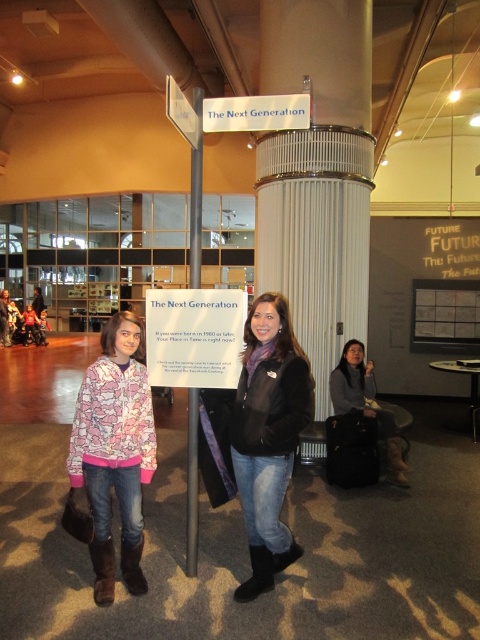
Question: Is black leather jacket at center smaller than dark gray sweater at center?

Choices:
 (A) yes
 (B) no

Answer: (A)

Question: Is the position of black leather jacket at center more distant than that of dark gray sweater at center?

Choices:
 (A) yes
 (B) no

Answer: (B)

Question: Observing the image, what is the correct spatial positioning of pink printed jacket at center in reference to white glossy pole at center?

Choices:
 (A) above
 (B) below

Answer: (B)

Question: Which object appears farthest from the camera in this image?

Choices:
 (A) black leather jacket at center
 (B) pink printed jacket at center
 (C) white glossy pole at center
 (D) dark gray sweater at center

Answer: (D)

Question: Which of the following is the farthest from the observer?

Choices:
 (A) black leather jacket at center
 (B) white glossy pole at center
 (C) pink printed jacket at center
 (D) dark gray sweater at center

Answer: (D)

Question: Which object is positioned farthest from the pink printed jacket at center?

Choices:
 (A) white glossy pole at center
 (B) black leather jacket at center
 (C) dark gray sweater at center

Answer: (C)